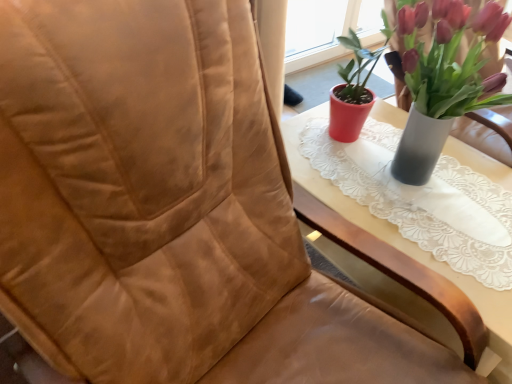
Identify the location of matte red pot at upper right. (443, 78).

The width and height of the screenshot is (512, 384). What do you see at coordinates (443, 78) in the screenshot?
I see `matte red pot at upper right` at bounding box center [443, 78].

What is the approximate height of matte red pot at upper right?

The height of matte red pot at upper right is 18.28 inches.

What do you see at coordinates (402, 242) in the screenshot? I see `wooden table at center` at bounding box center [402, 242].

Locate an element on the screen. The height and width of the screenshot is (384, 512). wooden table at center is located at coordinates (402, 242).

Identify the location of matte red pot at upper right. This screenshot has height=384, width=512. (443, 78).

Visually, is wooden table at center positioned to the left or to the right of matte red pot at upper right?

From the image, it's evident that wooden table at center is to the left of matte red pot at upper right.

Which object is further away from the camera, wooden table at center or matte red pot at upper right?

wooden table at center is more distant.

From the picture: Which is less distant, (393, 245) or (416, 175)?

Point (393, 245) is closer to the camera than point (416, 175).

From the image's perspective, which one is positioned lower, wooden table at center or matte red pot at upper right?

From the image's view, wooden table at center is below.

From a real-world perspective, between wooden table at center and matte red pot at upper right, who is vertically lower?

From a 3D spatial view, wooden table at center is below.

Is wooden table at center wider than matte red pot at upper right?

Indeed, wooden table at center has a greater width compared to matte red pot at upper right.

Is wooden table at center shorter than matte red pot at upper right?

Correct, wooden table at center is not as tall as matte red pot at upper right.

Who is smaller, wooden table at center or matte red pot at upper right?

Smaller between the two is matte red pot at upper right.

Is wooden table at center situated inside matte red pot at upper right or outside?

The correct answer is: outside.

Is wooden table at center directly adjacent to matte red pot at upper right?

No, wooden table at center is not beside matte red pot at upper right.

Could you tell me if wooden table at center is facing matte red pot at upper right?

No, wooden table at center is not oriented towards matte red pot at upper right.

Can you tell me how much wooden table at center and matte red pot at upper right differ in facing direction?

The angle between the facing direction of wooden table at center and the facing direction of matte red pot at upper right is 0.000299 degrees.

You are a GUI agent. You are given a task and a screenshot of the screen. Output one action in this format:
    pyautogui.click(x=<x>, y=<y>)
    Task: Click on the houseplant on the right side of wooden table at center
    This screenshot has width=512, height=384.
    Given the screenshot: What is the action you would take?
    pyautogui.click(x=443, y=78)

Which is more to the left, matte red pot at upper right or wooden table at center?

wooden table at center.

Which object is closer to the camera taking this photo, matte red pot at upper right or wooden table at center?

matte red pot at upper right.

Does point (460, 24) appear closer or farther from the camera than point (316, 190)?

Point (460, 24) is positioned closer to the camera compared to point (316, 190).

From the image's perspective, is matte red pot at upper right located beneath wooden table at center?

Incorrect, from the image's perspective, matte red pot at upper right is higher than wooden table at center.

From a real-world perspective, is matte red pot at upper right under wooden table at center?

No, from a real-world perspective, matte red pot at upper right is not beneath wooden table at center.

Consider the image. Considering the relative sizes of matte red pot at upper right and wooden table at center in the image provided, is matte red pot at upper right thinner than wooden table at center?

Indeed, matte red pot at upper right has a lesser width compared to wooden table at center.

Between matte red pot at upper right and wooden table at center, which one has more height?

matte red pot at upper right.

Considering the relative sizes of matte red pot at upper right and wooden table at center in the image provided, is matte red pot at upper right smaller than wooden table at center?

Yes.

Would you say wooden table at center is part of matte red pot at upper right's contents?

Definitely not — wooden table at center is not inside matte red pot at upper right.

Is matte red pot at upper right in contact with wooden table at center?

No.

Could you tell me if matte red pot at upper right is turned towards wooden table at center?

A: No.

Locate an element on the screen. table below the matte red pot at upper right (from a real-world perspective) is located at coordinates [402, 242].

Where is `table below the matte red pot at upper right (from a real-world perspective)`? This screenshot has width=512, height=384. table below the matte red pot at upper right (from a real-world perspective) is located at coordinates (402, 242).

This screenshot has width=512, height=384. In the image, there is a wooden table at center. In order to click on houseplant above it (from the image's perspective) in this screenshot , I will do `click(443, 78)`.